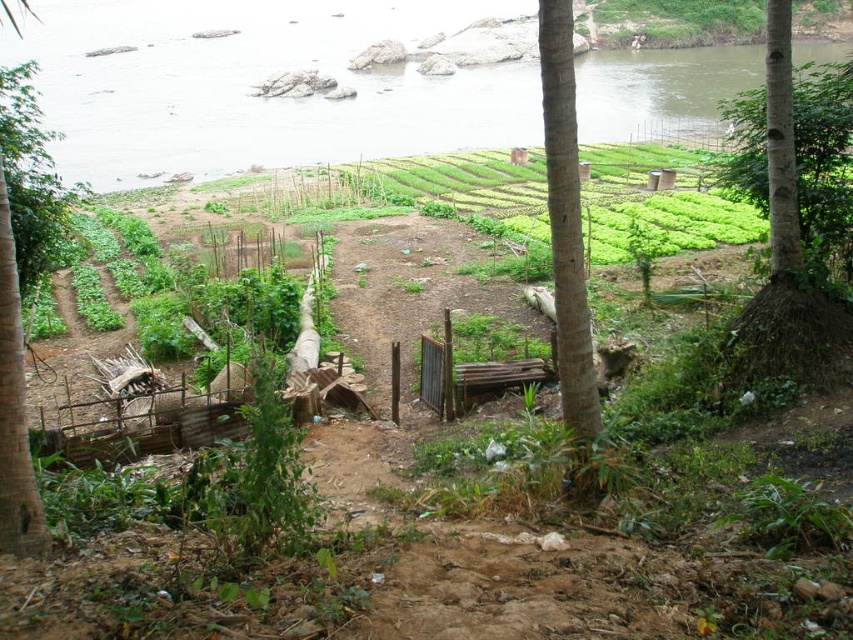
Based on the photo, you are a farmer who wants to place a small shed exactly halfway between the green water at upper center and the smooth bark tree at right. Given their sizes, will the shed fit comfortably without overlapping either object?

The green water at upper center is bigger than the smooth bark tree at right. Since the shed is placed halfway between them, the distance between the two objects must be sufficient to accommodate the shed. However, the question does not provide information about the distance between the objects or the shed size, so we cannot determine if it will fit comfortably.

Looking at this image, based on the scene description, where is the green water at upper center located in terms of coordinates?

The green water at upper center is located at coordinates point [256,84].

You are a farmer who wants to plant a new tree sapling. You have two options for planting locations based on the existing trees in the scene. The first option is near the brown rough tree trunk at center, and the second is near the smooth bark tree at right. Considering the sizes of the existing trees, which location might provide more space for the new sapling to grow?

The smooth bark tree at right is larger than the brown rough tree trunk at center. Therefore, planting the new sapling near the brown rough tree trunk at center might provide more space for growth since it is smaller.